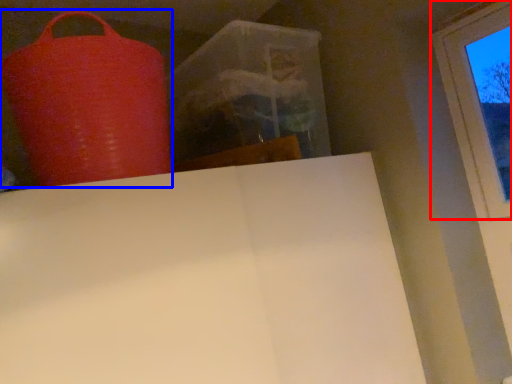
Question: Which object appears farthest to the camera in this image, window (highlighted by a red box) or punching bag (highlighted by a blue box)?

Choices:
 (A) window
 (B) punching bag

Answer: (A)